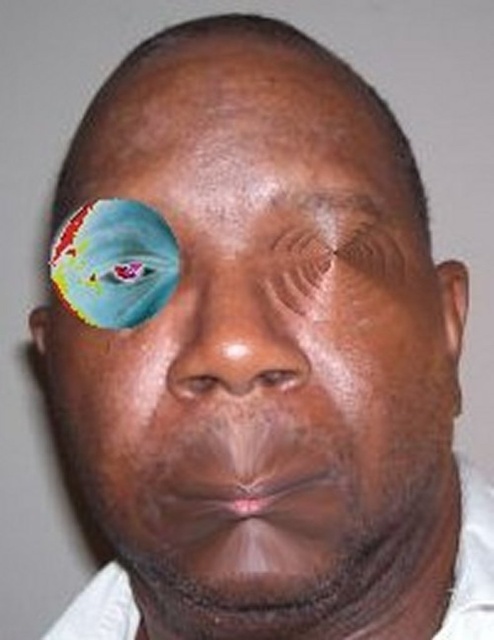
Question: Is smooth skin nose at center positioned in front of matte skin at center?

Choices:
 (A) yes
 (B) no

Answer: (A)

Question: Observing the image, what is the correct spatial positioning of dry skin eyebrow at upper center in reference to matte skin at center?

Choices:
 (A) below
 (B) above

Answer: (B)

Question: Can you confirm if smooth skin nose at center is positioned to the right of dry skin eyebrow at upper center?

Choices:
 (A) no
 (B) yes

Answer: (A)

Question: Which point is closer to the camera taking this photo?

Choices:
 (A) (331, 212)
 (B) (316, 268)

Answer: (B)

Question: Which of the following is the closest to the observer?

Choices:
 (A) white cotton dress shirt at lower right
 (B) smooth skin nose at center

Answer: (B)

Question: Which of the following is the closest to the observer?

Choices:
 (A) matte skin at center
 (B) smooth skin nose at center

Answer: (B)